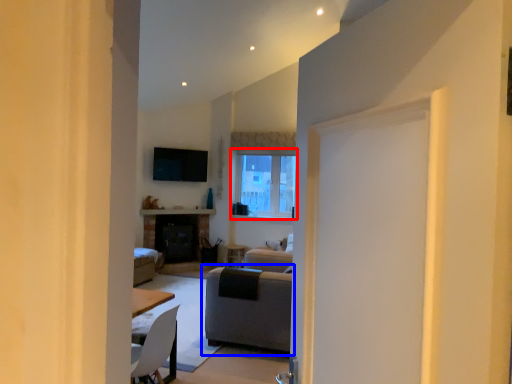
Question: Among these objects, which one is nearest to the camera, window (highlighted by a red box) or studio couch (highlighted by a blue box)?

Choices:
 (A) window
 (B) studio couch

Answer: (B)